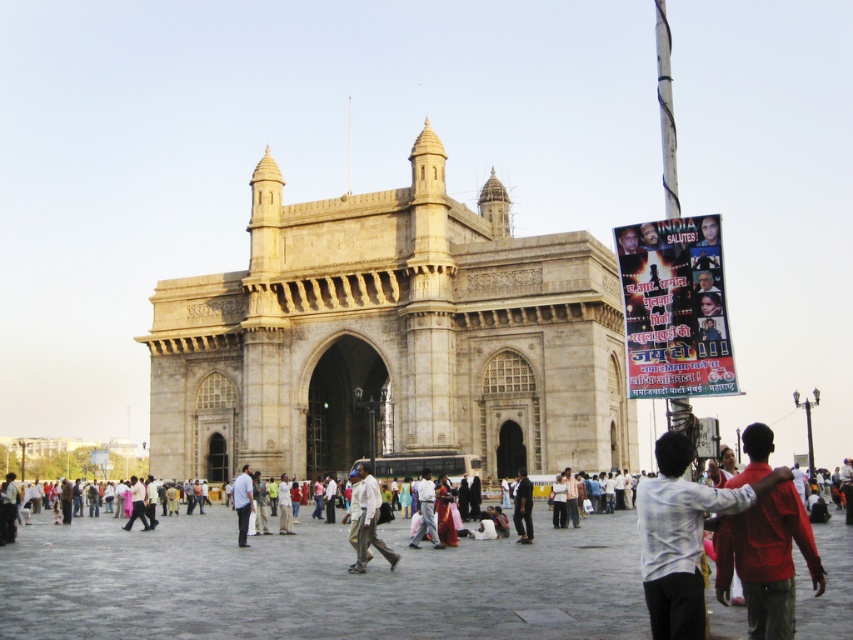
Who is taller, light blue shirt at center or light beige fabric shirt at center?

→ light beige fabric shirt at center

Which is behind, point (242, 474) or point (138, 486)?

The point (138, 486) is behind.

Find the location of a particular element. This screenshot has width=853, height=640. light blue shirt at center is located at coordinates pyautogui.click(x=242, y=500).

Can you confirm if beige stone gateway of india at center is thinner than dark blue fabric at center?

In fact, beige stone gateway of india at center might be wider than dark blue fabric at center.

Does beige stone gateway of india at center have a smaller size compared to dark blue fabric at center?

Actually, beige stone gateway of india at center might be larger than dark blue fabric at center.

Is point (563, 241) closer to camera compared to point (521, 468)?

Yes, it is.

Locate an element on the screen. The image size is (853, 640). beige stone gateway of india at center is located at coordinates (392, 340).

What do you see at coordinates (392, 340) in the screenshot? I see `beige stone gateway of india at center` at bounding box center [392, 340].

Which is more to the right, beige stone gateway of india at center or light blue shirt at center?

beige stone gateway of india at center is more to the right.

Where is `beige stone gateway of india at center`? The width and height of the screenshot is (853, 640). beige stone gateway of india at center is located at coordinates (392, 340).

Image resolution: width=853 pixels, height=640 pixels. Find the location of `beige stone gateway of india at center`. beige stone gateway of india at center is located at coordinates (392, 340).